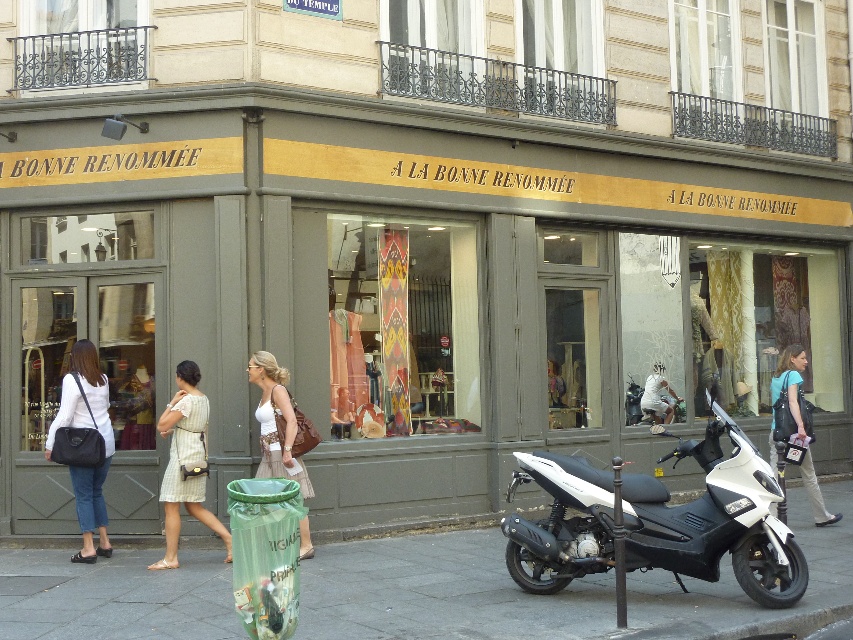
Question: Estimate the real-world distances between objects in this image. Which object is farther from the green plastic trash can at lower left?

Choices:
 (A) blue fabric backpack at lower right
 (B) matte black bag at lower left
 (C) matte gray storefront at center
 (D) white fabric dress at center

Answer: (C)

Question: Where is green plastic trash can at lower left located in relation to matte black bag at lower left in the image?

Choices:
 (A) above
 (B) below

Answer: (B)

Question: Which point is closer to the camera?

Choices:
 (A) white fabric dress at center
 (B) white matte scooter at center
 (C) blue fabric backpack at lower right

Answer: (B)

Question: Considering the real-world distances, which object is farthest from the white matte scooter at center?

Choices:
 (A) green plastic trash can at lower left
 (B) striped fabric dress at center

Answer: (B)

Question: Is white matte scooter at center to the right of matte black bag at lower left from the viewer's perspective?

Choices:
 (A) no
 (B) yes

Answer: (B)

Question: Is green plastic trash can at lower left closer to the viewer compared to striped fabric dress at center?

Choices:
 (A) yes
 (B) no

Answer: (A)